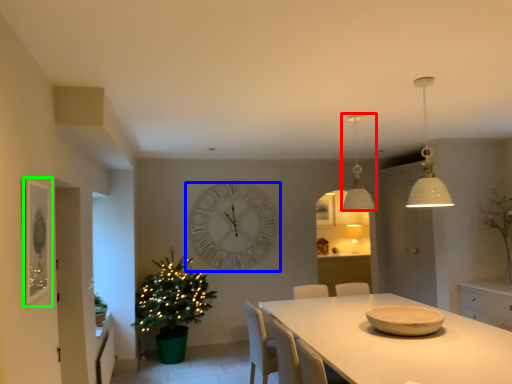
Question: Which object is positioned farthest from lamp (highlighted by a red box)? Select from wall clock (highlighted by a blue box) and picture frame (highlighted by a green box).

Choices:
 (A) wall clock
 (B) picture frame

Answer: (B)